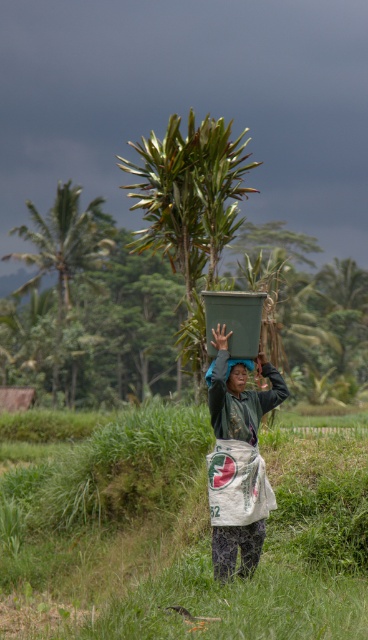
Question: Does green grass at center lie behind green leafy palm tree at left?

Choices:
 (A) no
 (B) yes

Answer: (A)

Question: Among these objects, which one is farthest from the camera?

Choices:
 (A) green grass at center
 (B) green leafy palm tree at left
 (C) matte green head at center
 (D) green matte box at center

Answer: (B)

Question: Estimate the real-world distances between objects in this image. Which object is closer to the green leafy palm tree at left?

Choices:
 (A) green matte box at center
 (B) matte green head at center
 (C) green grass at center

Answer: (C)

Question: Is green grass at center smaller than matte green head at center?

Choices:
 (A) yes
 (B) no

Answer: (B)

Question: Which of the following is the farthest from the observer?

Choices:
 (A) (104, 248)
 (B) (234, 480)
 (C) (228, 378)

Answer: (A)

Question: Considering the relative positions of green grass at center and green leafy palm tree at left in the image provided, where is green grass at center located with respect to green leafy palm tree at left?

Choices:
 (A) above
 (B) below

Answer: (B)